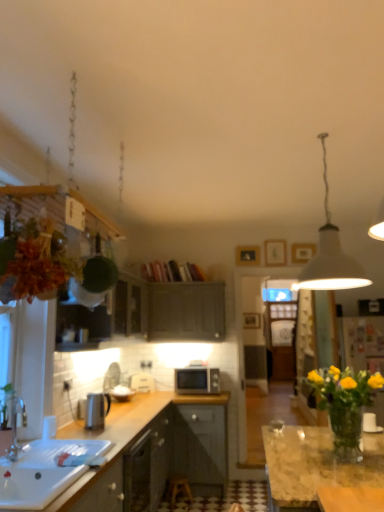
Question: Considering the relative sizes of leather-like brown plant hanger at upper left and white matte pendant lamp at upper right in the image provided, is leather-like brown plant hanger at upper left wider than white matte pendant lamp at upper right?

Choices:
 (A) no
 (B) yes

Answer: (A)

Question: Considering the relative sizes of leather-like brown plant hanger at upper left and white matte pendant lamp at upper right in the image provided, is leather-like brown plant hanger at upper left smaller than white matte pendant lamp at upper right?

Choices:
 (A) yes
 (B) no

Answer: (A)

Question: Is leather-like brown plant hanger at upper left at the right side of white matte pendant lamp at upper right?

Choices:
 (A) no
 (B) yes

Answer: (A)

Question: From the image's perspective, is leather-like brown plant hanger at upper left located above white matte pendant lamp at upper right?

Choices:
 (A) yes
 (B) no

Answer: (B)

Question: Considering the relative sizes of leather-like brown plant hanger at upper left and white matte pendant lamp at upper right in the image provided, is leather-like brown plant hanger at upper left taller than white matte pendant lamp at upper right?

Choices:
 (A) no
 (B) yes

Answer: (A)

Question: Is leather-like brown plant hanger at upper left directly adjacent to white matte pendant lamp at upper right?

Choices:
 (A) no
 (B) yes

Answer: (A)

Question: Is white matte microwave at center surrounding white matte pendant lamp at upper right?

Choices:
 (A) no
 (B) yes

Answer: (A)

Question: From a real-world perspective, is white matte microwave at center physically above white matte pendant lamp at upper right?

Choices:
 (A) yes
 (B) no

Answer: (B)

Question: Would you consider white matte microwave at center to be distant from white matte pendant lamp at upper right?

Choices:
 (A) no
 (B) yes

Answer: (B)

Question: From the image's perspective, is white matte microwave at center under white matte pendant lamp at upper right?

Choices:
 (A) yes
 (B) no

Answer: (A)

Question: Is white matte microwave at center further to the viewer compared to white matte pendant lamp at upper right?

Choices:
 (A) no
 (B) yes

Answer: (B)

Question: Does white matte microwave at center have a smaller size compared to white matte pendant lamp at upper right?

Choices:
 (A) no
 (B) yes

Answer: (B)

Question: From the image's perspective, would you say wooden stool at center is positioned over metallic silver kettle at left?

Choices:
 (A) no
 (B) yes

Answer: (A)